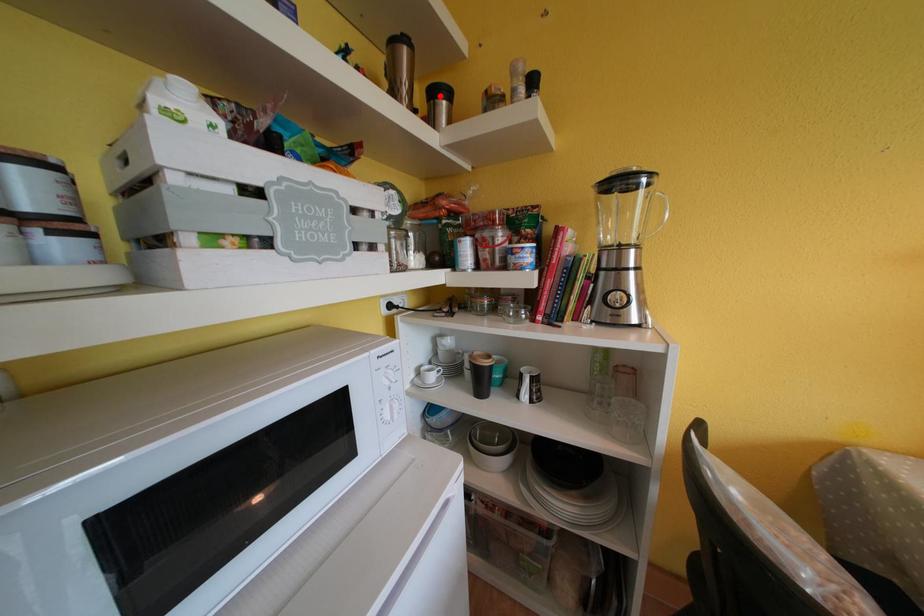
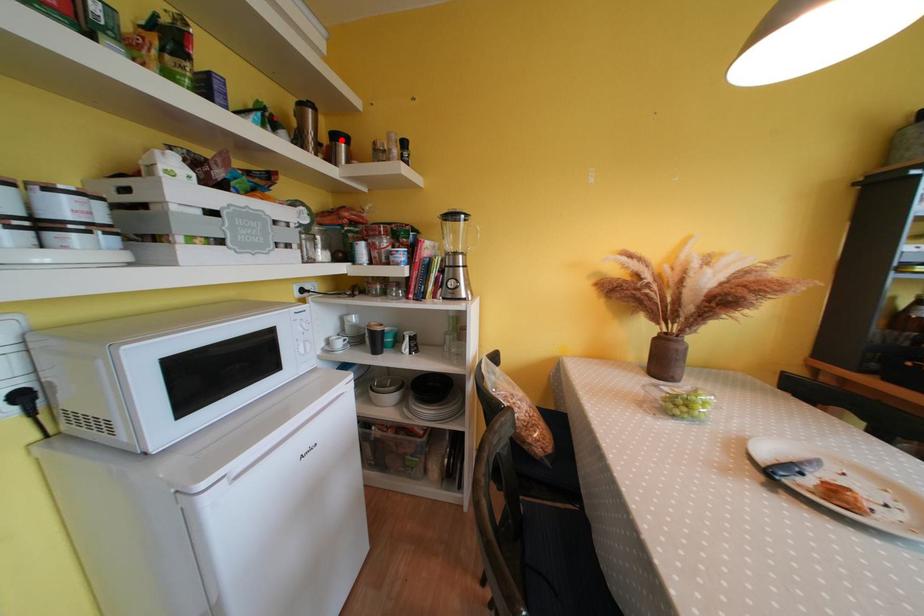
I am providing you with two images of the same scene from different viewpoints. A red point is marked on the first image and another point is marked on the second image. Are the points marked in image1 and image2 representing the same 3D position?

Yes